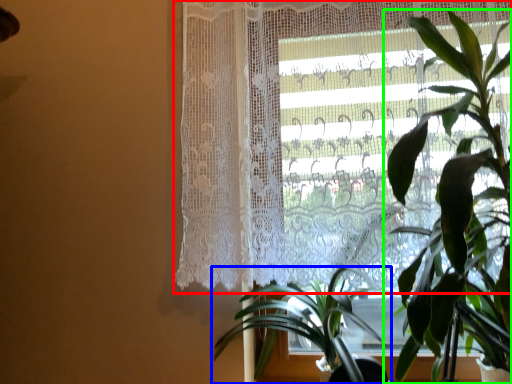
Question: Based on their relative distances, which object is nearer to curtain (highlighted by a red box)? Choose from houseplant (highlighted by a blue box) and houseplant (highlighted by a green box).

Choices:
 (A) houseplant
 (B) houseplant

Answer: (B)